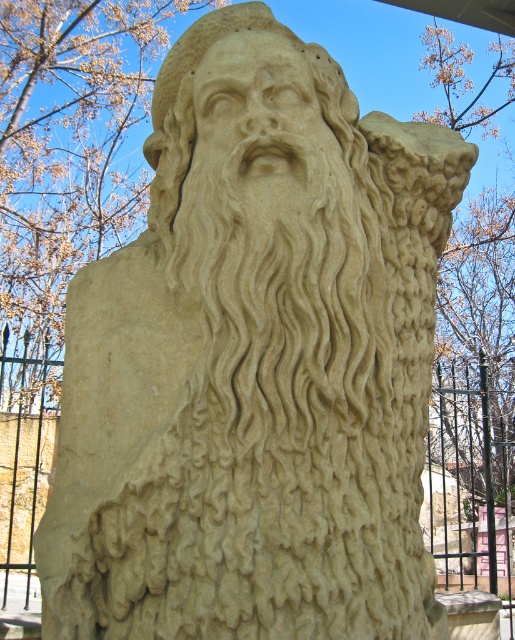
Question: Which point is farther to the camera?

Choices:
 (A) black metal fence at upper center
 (B) beige stone head at center

Answer: (A)

Question: Does black metal fence at upper center have a smaller size compared to beige stone head at center?

Choices:
 (A) yes
 (B) no

Answer: (B)

Question: Does black metal fence at upper center appear over beige stone head at center?

Choices:
 (A) yes
 (B) no

Answer: (B)

Question: Can you confirm if black metal fence at upper center is smaller than beige stone head at center?

Choices:
 (A) yes
 (B) no

Answer: (B)